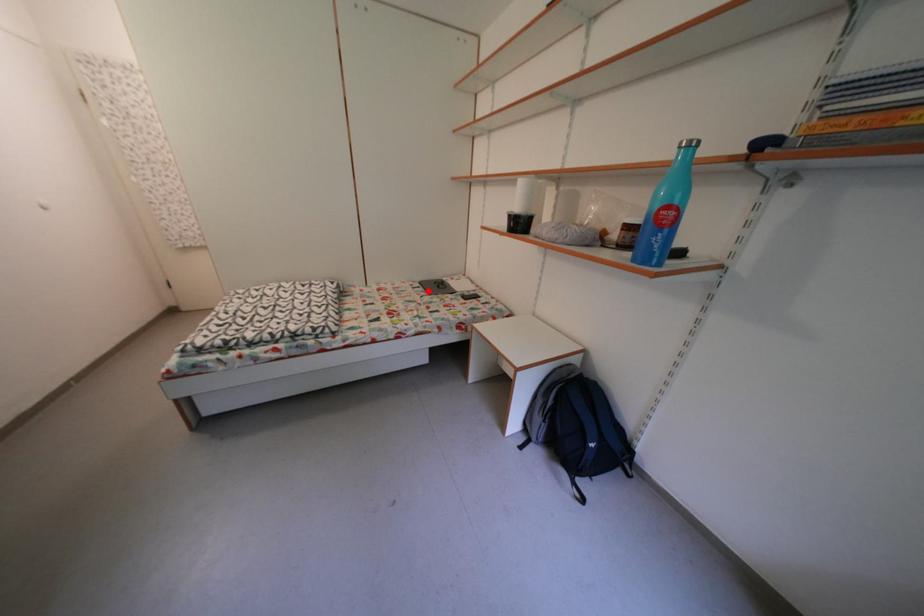
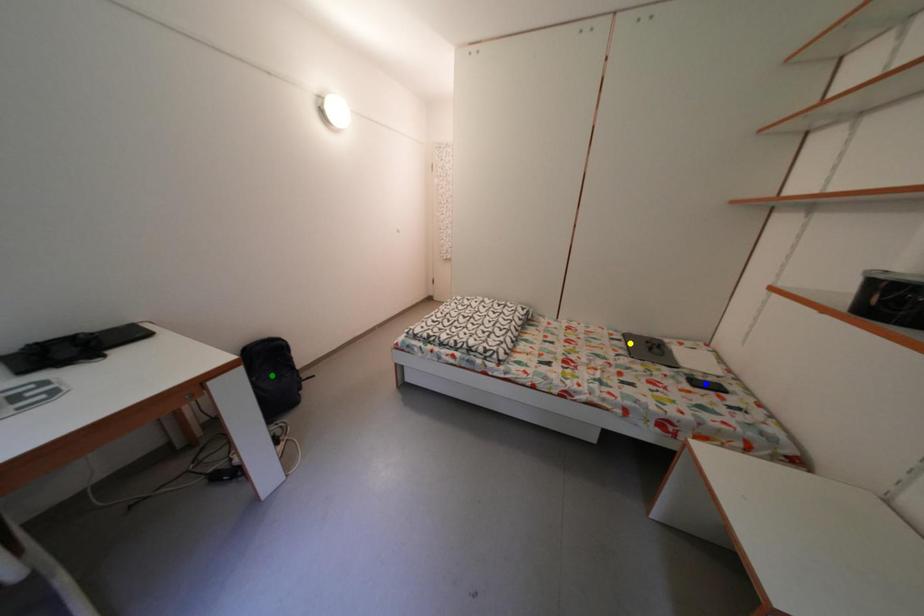
Question: I am providing you with two images of the same scene from different viewpoints. A red point is marked on the first image. You are given multiple points on the second image. In image 2, which mark is for the same physical point as the one in image 1?

Choices:
 (A) blue point
 (B) green point
 (C) yellow point

Answer: (C)